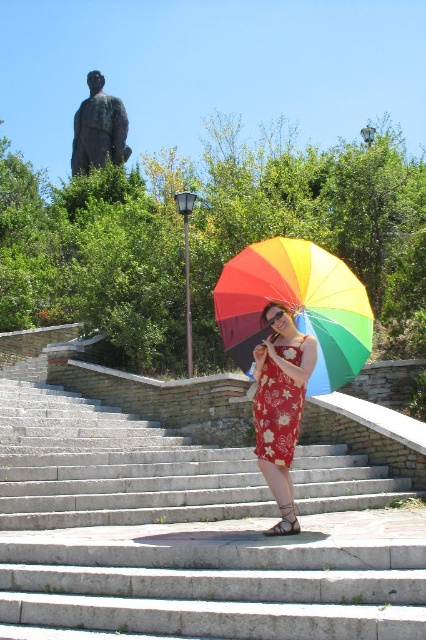
Question: Which object is positioned closest to the floral printed fabric dress at center?

Choices:
 (A) bronze statue at upper left
 (B) gray concrete stairs at center
 (C) floral dress at center
 (D) rainbow fabric umbrella at center

Answer: (C)

Question: Is gray concrete stairs at center smaller than rainbow fabric umbrella at center?

Choices:
 (A) no
 (B) yes

Answer: (A)

Question: Which object is positioned closest to the floral printed fabric dress at center?

Choices:
 (A) rainbow fabric umbrella at center
 (B) gray concrete stairs at center

Answer: (A)

Question: Where is gray concrete stairs at center located in relation to floral printed fabric dress at center in the image?

Choices:
 (A) right
 (B) left

Answer: (B)

Question: Does floral printed fabric dress at center appear on the right side of bronze statue at upper left?

Choices:
 (A) no
 (B) yes

Answer: (B)

Question: Which of the following is the farthest from the observer?

Choices:
 (A) rainbow fabric umbrella at center
 (B) floral dress at center
 (C) bronze statue at upper left
 (D) gray concrete stairs at center

Answer: (C)